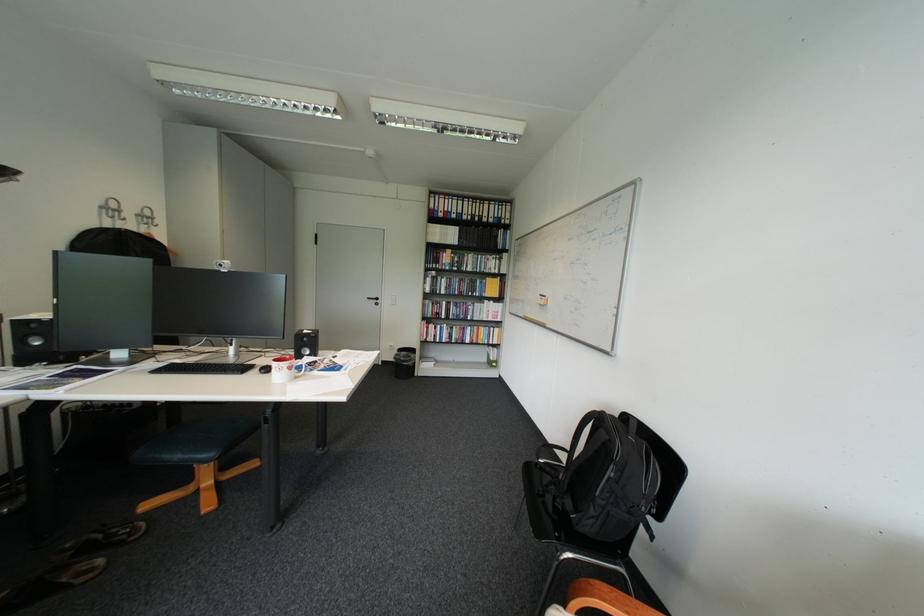
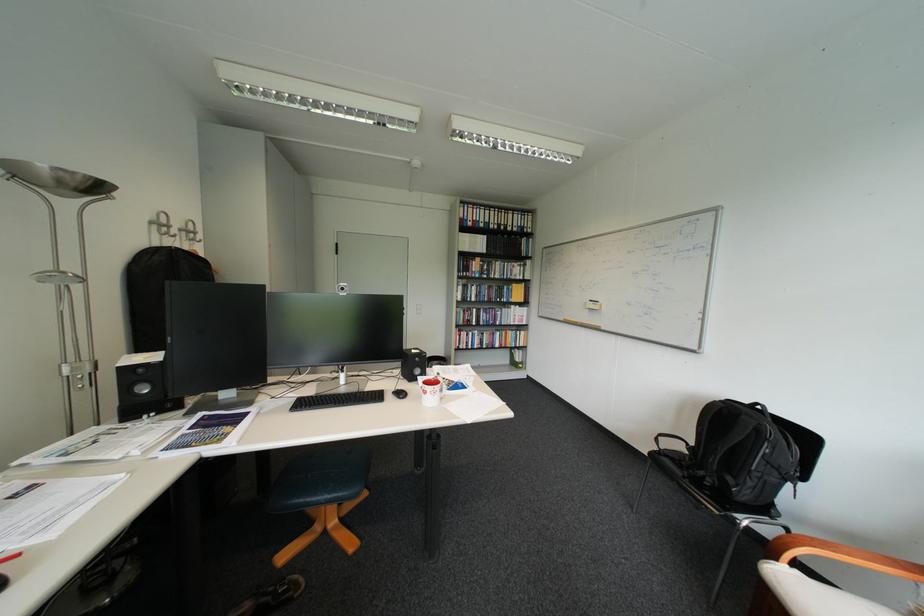
In the second image, find the point that corresponds to point (477, 215) in the first image.

(504, 224)